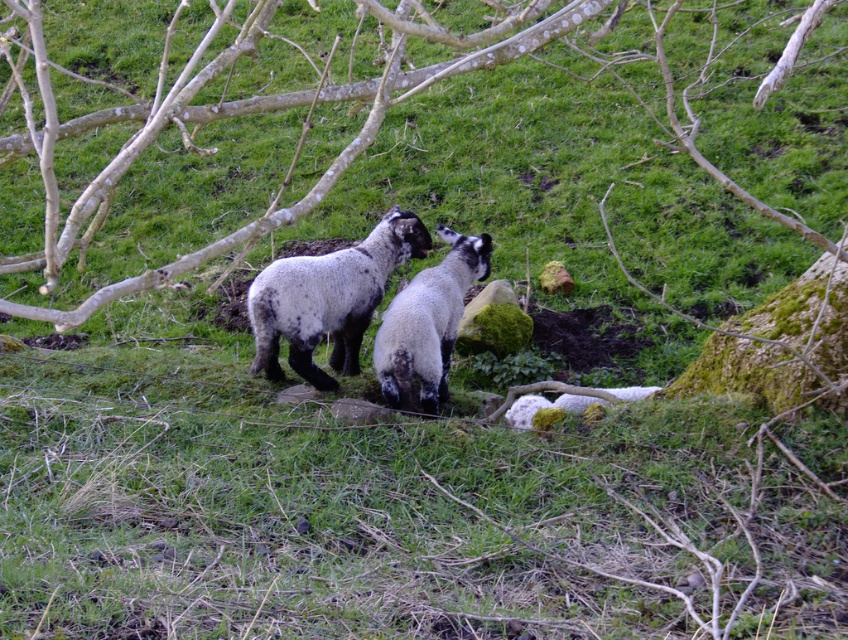
You are a photographer trying to capture both the speckled woolen sheep at center and the speckled wool sheep at center in a single frame. Which sheep is closer to the camera, allowing you to focus on it first?

The speckled wool sheep at center is closer to the camera than the speckled woolen sheep at center, so you can focus on it first.

You are a shepherd trying to locate your two sheep in the pasture. According to the image, which of the two speckled woolen sheep at center and speckled wool sheep at center is positioned higher up the hill?

The speckled woolen sheep at center is positioned higher up the hill than the speckled wool sheep at center.